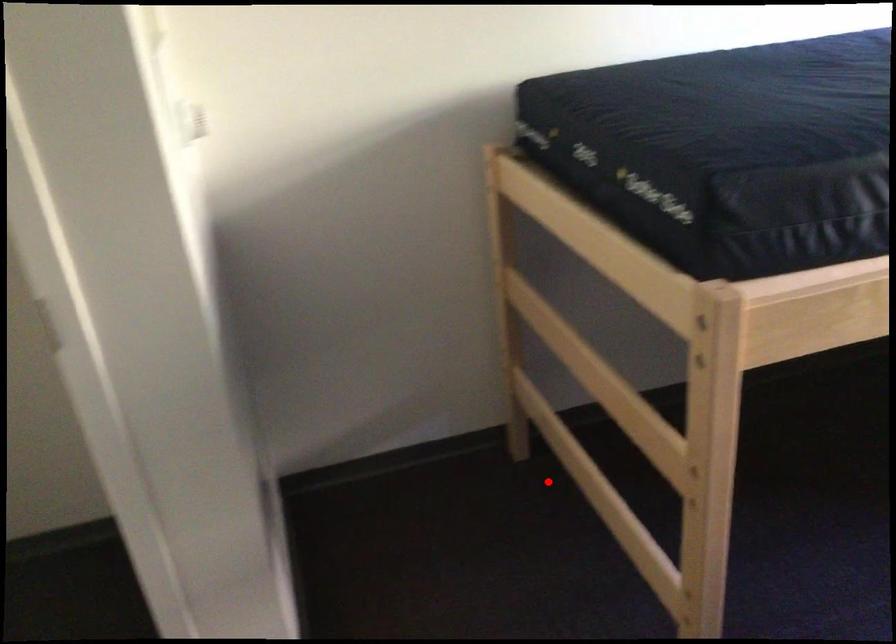
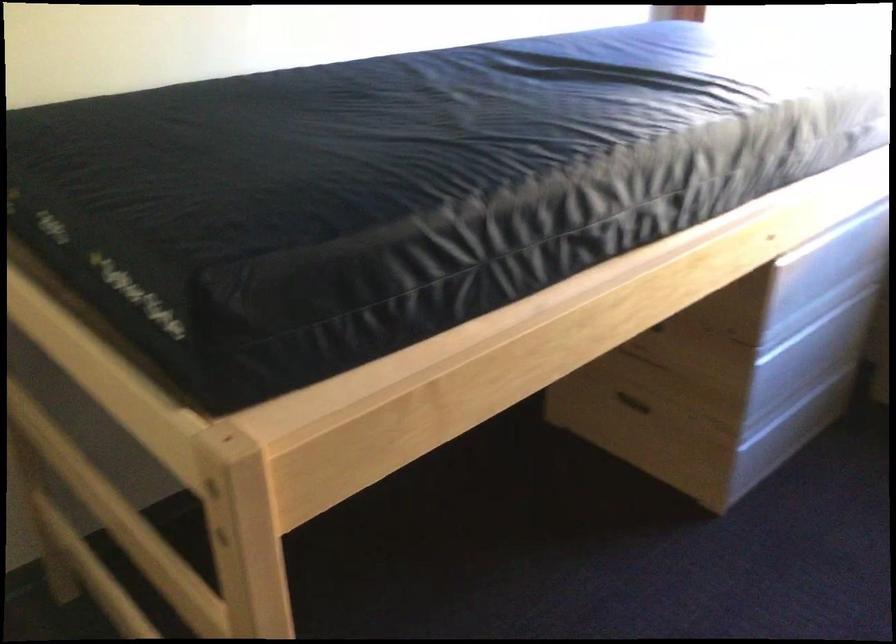
Question: I am providing you with two images of the same scene from different viewpoints. A red point is shown in image1. For the corresponding object point in image2, is it positioned nearer or farther from the camera?

Choices:
 (A) Nearer
 (B) Farther

Answer: (A)